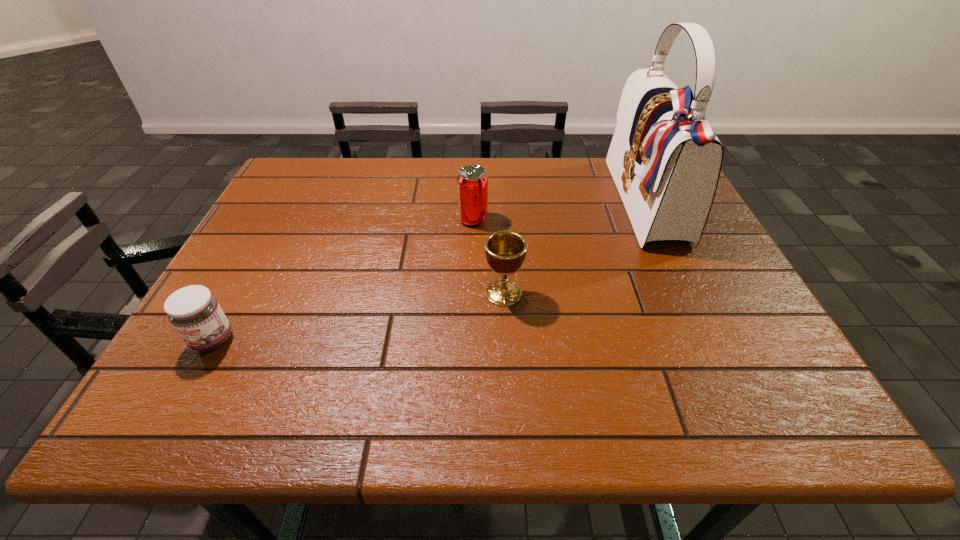
Find the location of a particular element. This screenshot has width=960, height=540. the tallest object is located at coordinates 665,160.

Identify the location of the rightmost object. Image resolution: width=960 pixels, height=540 pixels. (665, 160).

You are a GUI agent. You are given a task and a screenshot of the screen. Output one action in this format:
    pyautogui.click(x=<x>, y=<y>)
    Task: Click on the soda can
    
    Given the screenshot: What is the action you would take?
    pyautogui.click(x=472, y=181)

Find the location of a particular element. chalice is located at coordinates (505, 251).

This screenshot has width=960, height=540. I want to click on the leftmost object, so click(195, 313).

The image size is (960, 540). Identify the location of the shortest object. (195, 313).

Image resolution: width=960 pixels, height=540 pixels. Find the location of `vacant space located on the front-facing side of the tallest object`. vacant space located on the front-facing side of the tallest object is located at coordinates (572, 204).

Where is `vacant space located 0.260m on the front-facing side of the tallest object`? vacant space located 0.260m on the front-facing side of the tallest object is located at coordinates (521, 204).

The height and width of the screenshot is (540, 960). Find the location of `vacant space located on the front-facing side of the tallest object`. vacant space located on the front-facing side of the tallest object is located at coordinates [x=499, y=204].

Locate an element on the screen. This screenshot has height=540, width=960. free space located on the right of the soda can is located at coordinates 518,219.